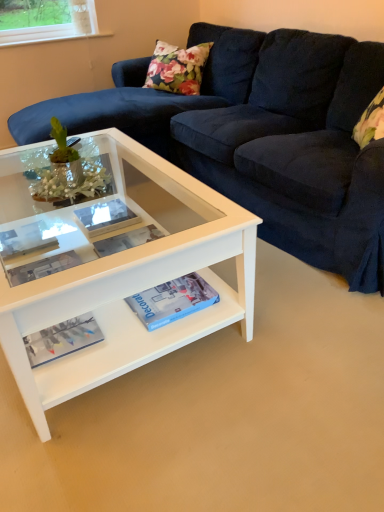
Describe the element at coordinates (117, 268) in the screenshot. I see `white glossy coffee table at center` at that location.

Image resolution: width=384 pixels, height=512 pixels. What do you see at coordinates (62, 339) in the screenshot? I see `matte blue magazine at lower left` at bounding box center [62, 339].

The width and height of the screenshot is (384, 512). Identify the location of white glossy coffee table at center. (117, 268).

Is velvet dark blue couch at center in front of or behind matte blue magazine at lower left in the image?

velvet dark blue couch at center is in front of matte blue magazine at lower left.

Can you tell me how much velvet dark blue couch at center and matte blue magazine at lower left differ in facing direction?

0.191 degrees separate the facing orientations of velvet dark blue couch at center and matte blue magazine at lower left.

The height and width of the screenshot is (512, 384). I want to click on magazine behind the velvet dark blue couch at center, so click(62, 339).

Based on their sizes in the image, would you say velvet dark blue couch at center is bigger or smaller than matte blue magazine at lower left?

In the image, velvet dark blue couch at center appears to be larger than matte blue magazine at lower left.

Is matte white paperback book at center, placed as the second paperback book when sorted from right to left, wider or thinner than blue matte paperback book at center, the 2th paperback book positioned from the back?

matte white paperback book at center, placed as the second paperback book when sorted from right to left, is thinner than blue matte paperback book at center, the 2th paperback book positioned from the back.

Is matte white paperback book at center, the first paperback book in the top-to-bottom sequence, next to blue matte paperback book at center, acting as the 2th paperback book starting from the top?

matte white paperback book at center, the first paperback book in the top-to-bottom sequence, is not next to blue matte paperback book at center, acting as the 2th paperback book starting from the top, and they're not touching.

Between point (121, 210) and point (161, 301), which one is positioned in front?

The point (161, 301) is in front.

In terms of size, does matte white paperback book at center, the first paperback book in the top-to-bottom sequence, appear bigger or smaller than blue matte paperback book at center, placed as the first paperback book when sorted from front to back?

Considering their sizes, matte white paperback book at center, the first paperback book in the top-to-bottom sequence, takes up less space than blue matte paperback book at center, placed as the first paperback book when sorted from front to back.

From the picture: Considering the positions of objects matte white paperback book at center, which is counted as the second paperback book, starting from the bottom, and matte white book at center in the image provided, who is more to the left, matte white paperback book at center, which is counted as the second paperback book, starting from the bottom, or matte white book at center?

From the viewer's perspective, matte white book at center appears more on the left side.

Can you confirm if matte white paperback book at center, which is counted as the first paperback book, starting from the left, is bigger than matte white book at center?

Yes.

Measure the distance from matte white paperback book at center, which is counted as the first paperback book, starting from the left, to matte white book at center.

matte white paperback book at center, which is counted as the first paperback book, starting from the left, and matte white book at center are 10.23 inches apart from each other.

At what (x,y) coordinates should I click in order to perform the action: click on paperback book that is the 1st object to the right of the matte white book at center, starting at the anchor. Please return your answer as a coordinate pair (x, y). Looking at the image, I should click on point(105,217).

Can you confirm if matte white book at center is wider than matte blue magazine at lower left?

Correct, the width of matte white book at center exceeds that of matte blue magazine at lower left.

Is matte blue magazine at lower left completely or partially inside matte white book at center?

No, matte blue magazine at lower left is not surrounded by matte white book at center.

Identify the location of book that appears on the left of matte blue magazine at lower left. (25, 242).

Consider the image. Considering the sizes of objects matte white book at center and matte blue magazine at lower left in the image provided, who is bigger, matte white book at center or matte blue magazine at lower left?

matte white book at center is bigger.

Is velvet dark blue couch at center oriented away from blue matte paperback book at center, the 2th paperback book when ordered from left to right?

No, velvet dark blue couch at center's orientation is not away from blue matte paperback book at center, the 2th paperback book when ordered from left to right.

Is velvet dark blue couch at center with blue matte paperback book at center, placed as the 1th paperback book when sorted from bottom to top?

No, velvet dark blue couch at center is not beside blue matte paperback book at center, placed as the 1th paperback book when sorted from bottom to top.

Is velvet dark blue couch at center surrounding blue matte paperback book at center, placed as the 1th paperback book when sorted from bottom to top?

Yes.

From a real-world perspective, between matte blue magazine at lower left and velvet dark blue couch at center, who is vertically lower?

In real-world perspective, matte blue magazine at lower left is lower.

From the image's perspective, would you say matte blue magazine at lower left is shown under velvet dark blue couch at center?

Indeed, from the image's perspective, matte blue magazine at lower left is shown beneath velvet dark blue couch at center.

Is matte blue magazine at lower left taller or shorter than velvet dark blue couch at center?

Clearly, matte blue magazine at lower left is shorter compared to velvet dark blue couch at center.

Is velvet dark blue couch at center surrounded by matte blue magazine at lower left?

Answer: Actually, velvet dark blue couch at center is outside matte blue magazine at lower left.

Does point (203, 296) come closer to viewer compared to point (132, 214)?

Yes, point (203, 296) is in front of point (132, 214).

From a real-world perspective, who is located lower, blue matte paperback book at center, the 2th paperback book when ordered from left to right, or matte white paperback book at center, which is counted as the first paperback book, starting from the left?

matte white paperback book at center, which is counted as the first paperback book, starting from the left, from a real-world perspective.

Which is more to the right, blue matte paperback book at center, acting as the 2th paperback book starting from the top, or matte white paperback book at center, which is counted as the first paperback book, starting from the back?

From the viewer's perspective, blue matte paperback book at center, acting as the 2th paperback book starting from the top, appears more on the right side.

Locate an element on the screen. The width and height of the screenshot is (384, 512). magazine behind the velvet dark blue couch at center is located at coordinates (62, 339).

There is a matte white paperback book at center, which is counted as the first paperback book, starting from the back. Find the location of `paperback book above it (from a real-world perspective)`. paperback book above it (from a real-world perspective) is located at coordinates 172,300.

Looking at the image, which one is located closer to matte blue magazine at lower left, matte white book at center or white glossy coffee table at center?

Based on the image, white glossy coffee table at center appears to be nearer to matte blue magazine at lower left.

Looking at the image, which one is located closer to velvet dark blue couch at center, matte blue magazine at lower left or blue matte paperback book at center, the 2th paperback book when ordered from left to right?

blue matte paperback book at center, the 2th paperback book when ordered from left to right, is closer to velvet dark blue couch at center.

When comparing their distances from matte white book at center, does matte blue magazine at lower left or blue matte paperback book at center, placed as the first paperback book when sorted from front to back, seem closer?

The object closer to matte white book at center is matte blue magazine at lower left.

Considering their positions, is matte white book at center positioned further to white glossy coffee table at center than blue matte paperback book at center, placed as the 1th paperback book when sorted from bottom to top?

Among the two, matte white book at center is located further to white glossy coffee table at center.

When comparing their distances from matte white paperback book at center, which is counted as the first paperback book, starting from the back, does white glossy coffee table at center or velvet dark blue couch at center seem closer?

white glossy coffee table at center is closer to matte white paperback book at center, which is counted as the first paperback book, starting from the back.

Considering their positions, is matte white book at center positioned further to velvet dark blue couch at center than matte white paperback book at center, which is counted as the second paperback book, starting from the bottom?

matte white book at center.

Which object lies nearer to the anchor point velvet dark blue couch at center, blue matte paperback book at center, the 2th paperback book positioned from the back, or matte white paperback book at center, which is counted as the second paperback book, starting from the bottom?

matte white paperback book at center, which is counted as the second paperback book, starting from the bottom, is positioned closer to the anchor velvet dark blue couch at center.

When comparing their distances from matte blue magazine at lower left, does blue matte paperback book at center, the 2th paperback book positioned from the back, or white glossy coffee table at center seem closer?

The object closer to matte blue magazine at lower left is blue matte paperback book at center, the 2th paperback book positioned from the back.

Find the location of `paperback book located between velvet dark blue couch at center and matte white book at center in the depth direction`. paperback book located between velvet dark blue couch at center and matte white book at center in the depth direction is located at coordinates (172, 300).

Identify the location of paperback book between velvet dark blue couch at center and matte white paperback book at center, which is counted as the first paperback book, starting from the back, from front to back. (172, 300).

This screenshot has width=384, height=512. In order to click on coffee table between velvet dark blue couch at center and matte blue magazine at lower left in the up-down direction in this screenshot , I will do `click(117, 268)`.

This screenshot has width=384, height=512. Find the location of `magazine located between white glossy coffee table at center and matte white book at center in the depth direction`. magazine located between white glossy coffee table at center and matte white book at center in the depth direction is located at coordinates (62, 339).